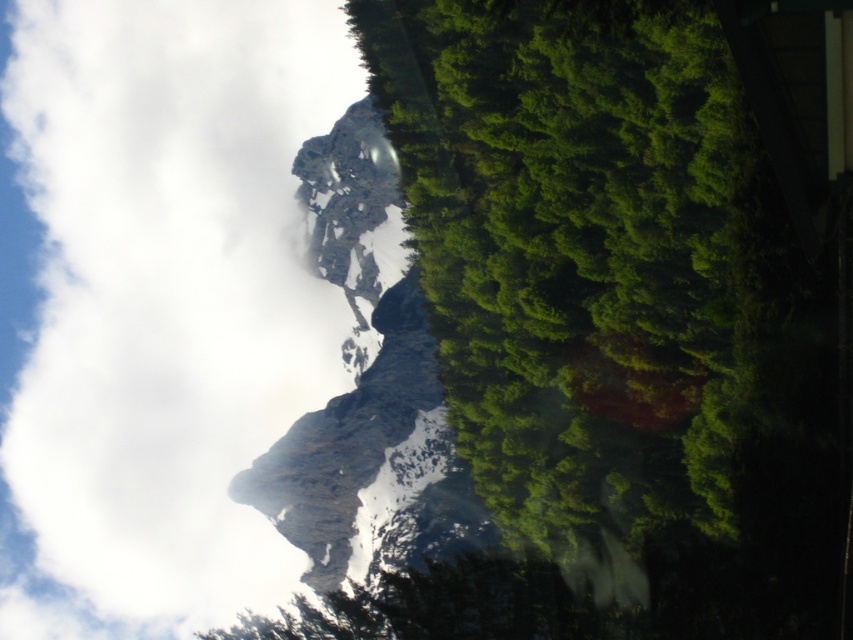
Can you confirm if white fluffy cloud at upper left is shorter than green leafy tree at center?

In fact, white fluffy cloud at upper left may be taller than green leafy tree at center.

Between point (131, 604) and point (722, 200), which one is positioned in front?

Point (722, 200) is in front.

At what (x,y) coordinates should I click in order to perform the action: click on white fluffy cloud at upper left. Please return your answer as a coordinate pair (x, y). This screenshot has height=640, width=853. Looking at the image, I should click on (166, 298).